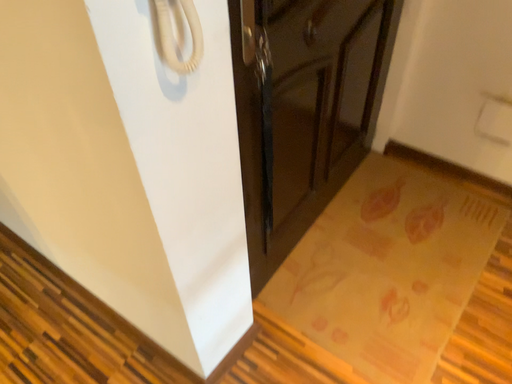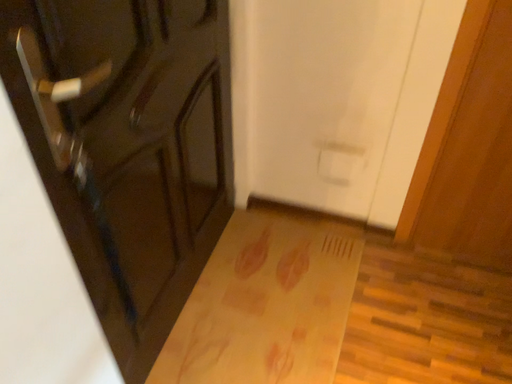
Question: Which way did the camera rotate in the video?

Choices:
 (A) rotated left
 (B) rotated right

Answer: (B)